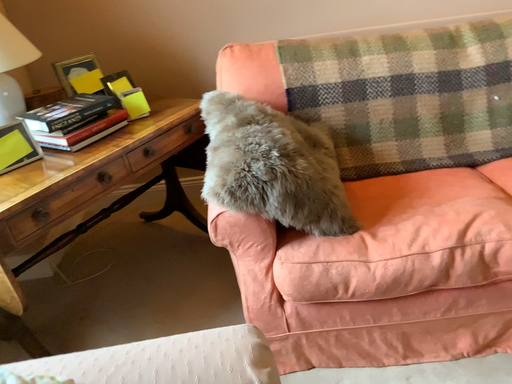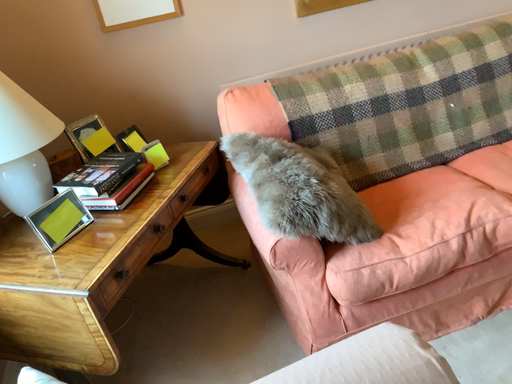
Question: How did the camera likely rotate when shooting the video?

Choices:
 (A) rotated left
 (B) rotated right

Answer: (B)